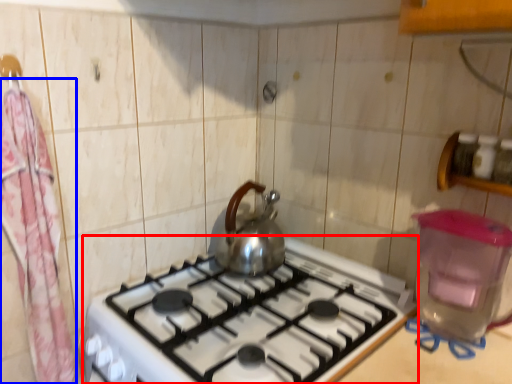
Question: Which of the following is the closest to the observer, gas stove (highlighted by a red box) or curtain (highlighted by a blue box)?

Choices:
 (A) gas stove
 (B) curtain

Answer: (A)